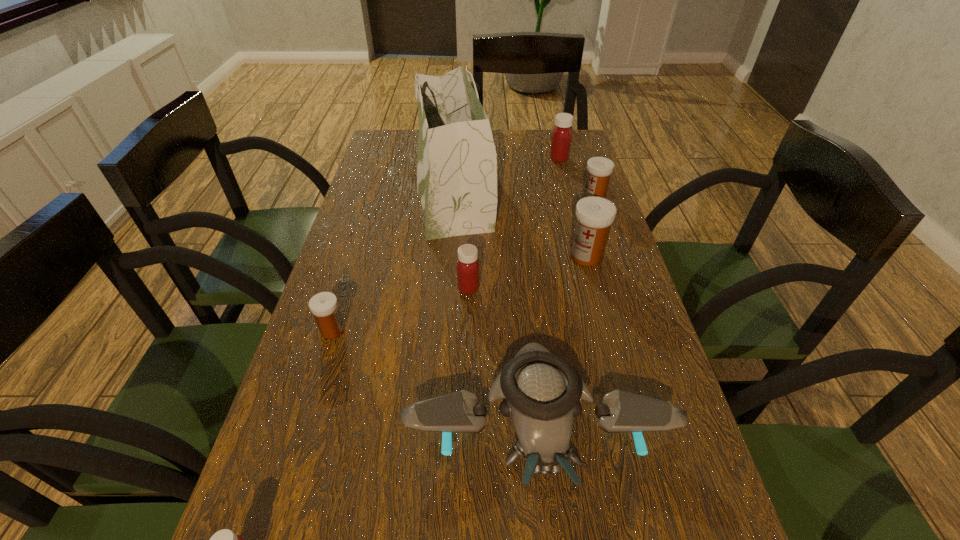
Locate an element on the screen. The image size is (960, 540). gray drone is located at coordinates (541, 391).

Locate an element on the screen. This screenshot has width=960, height=540. drone is located at coordinates (541, 391).

Identify the location of the leftmost white medicine. This screenshot has height=540, width=960. (324, 306).

Locate an element on the screen. The width and height of the screenshot is (960, 540). the third nearest object is located at coordinates (324, 306).

Identify the location of blank space located 0.350m on the front of the tallest object. The width and height of the screenshot is (960, 540). (441, 346).

Identify the location of free space located on the front of the biggest red medicine. This screenshot has height=540, width=960. click(x=575, y=224).

What are the coordinates of `vacant position located 0.080m on the left of the fourth farthest object` in the screenshot? It's located at (538, 255).

The width and height of the screenshot is (960, 540). What are the coordinates of `vacant position located 0.350m on the back of the fifth nearest medicine` in the screenshot? It's located at (574, 138).

This screenshot has height=540, width=960. I want to click on blank space located 0.050m on the right of the third nearest medicine, so click(x=500, y=288).

Where is `vacant region located 0.330m on the back of the second nearest medicine`? The image size is (960, 540). vacant region located 0.330m on the back of the second nearest medicine is located at coordinates (364, 228).